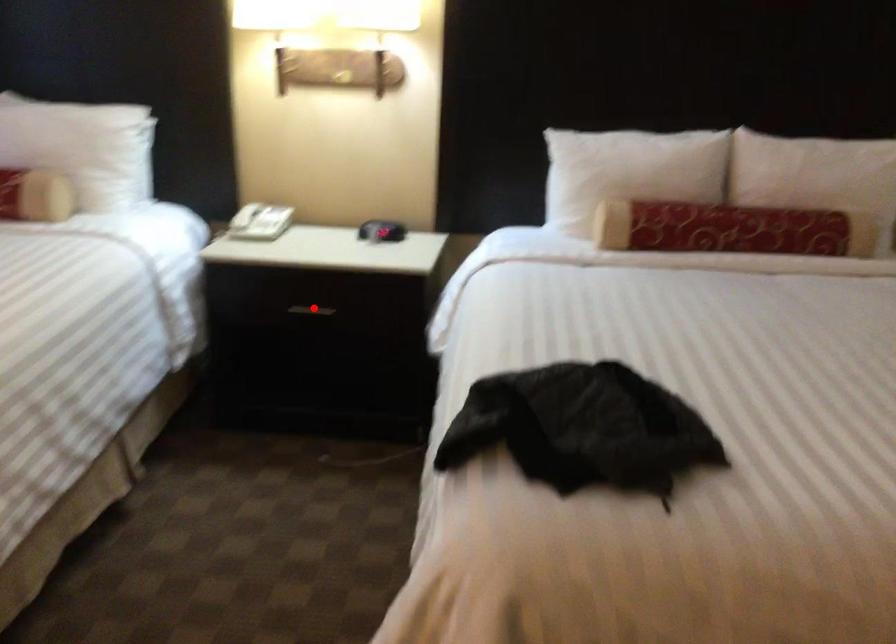
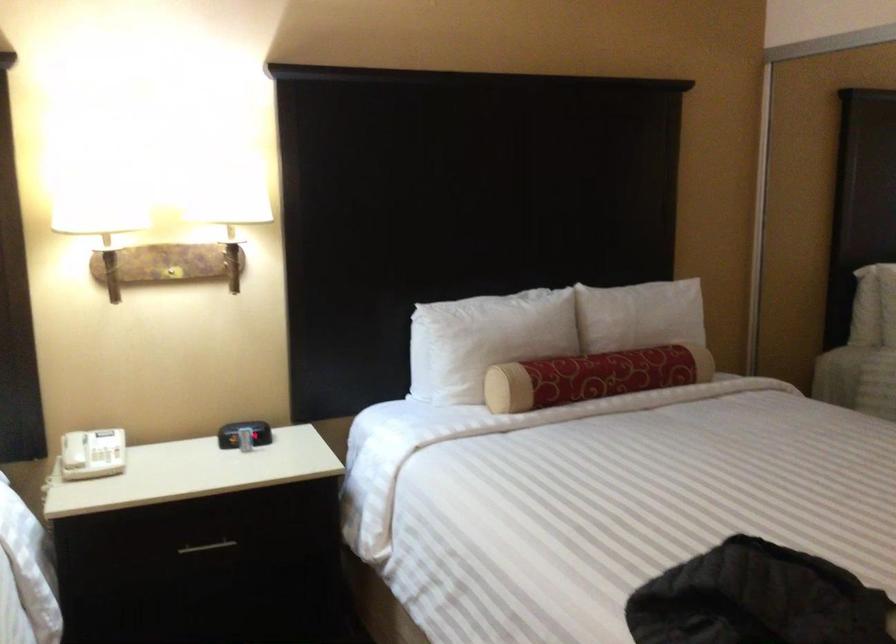
Question: I am providing you with two images of the same scene from different viewpoints. Given a red point in image1, look at the same physical point in image2. Is it:

Choices:
 (A) Closer to the viewpoint
 (B) Farther from the viewpoint

Answer: (A)